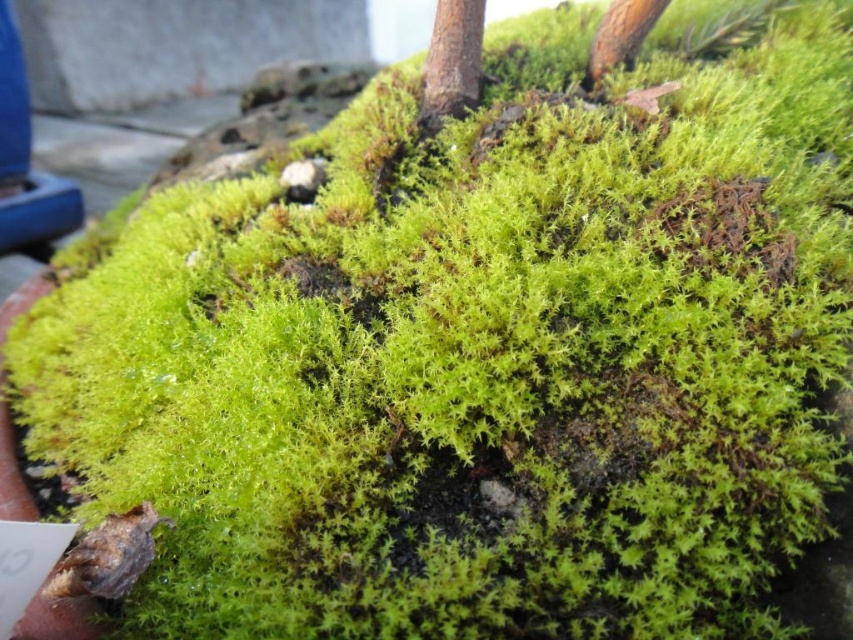
You are a hiker who wants to place a small marker at the point marked by point (451,61). What object will the marker be placed on?

The marker will be placed on the smooth brown tree trunk at upper center located at point (451,61).

From the picture: You are a gardener who needs to place a 30 cm wide decorative stone between the smooth brown tree trunk at upper center and the brown rough wood at upper right. Can the space between them accommodate the stone?

The distance between the smooth brown tree trunk at upper center and the brown rough wood at upper right is 32.37 centimeters. Since the decorative stone is 30 cm wide, it can fit in the space between them as the distance is slightly larger than the stone.